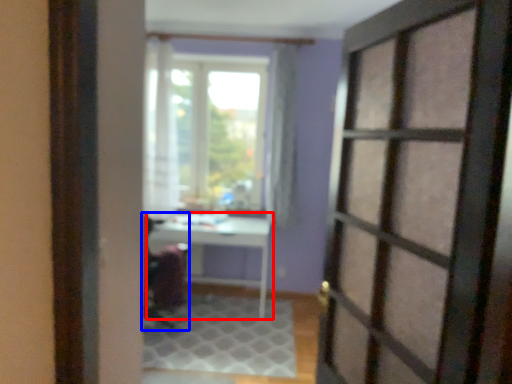
Question: Which object appears farthest to the camera in this image, table (highlighted by a red box) or armchair (highlighted by a blue box)?

Choices:
 (A) table
 (B) armchair

Answer: (A)